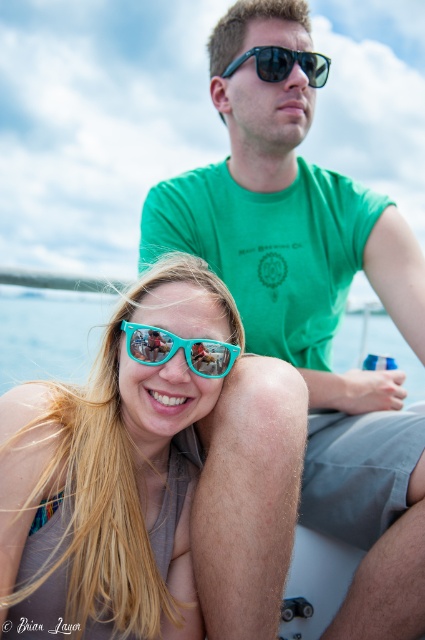
You are a photographer trying to capture a clear shot of both the teal plastic sunglasses at center and the sunglasses at upper center. Since you want to focus on the larger one, which sunglasses should you zoom in on?

The teal plastic sunglasses at center is larger in size than the sunglasses at upper center, so you should zoom in on the teal plastic sunglasses at center to focus on the larger one.